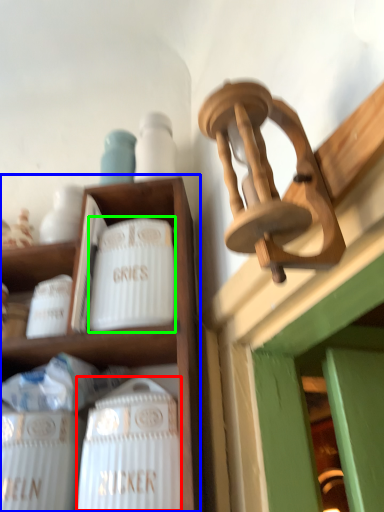
Question: Based on their relative distances, which object is farther from wine bottle (highlighted by a red box)? Choose from shelf (highlighted by a blue box) and pottery (highlighted by a green box).

Choices:
 (A) shelf
 (B) pottery

Answer: (B)